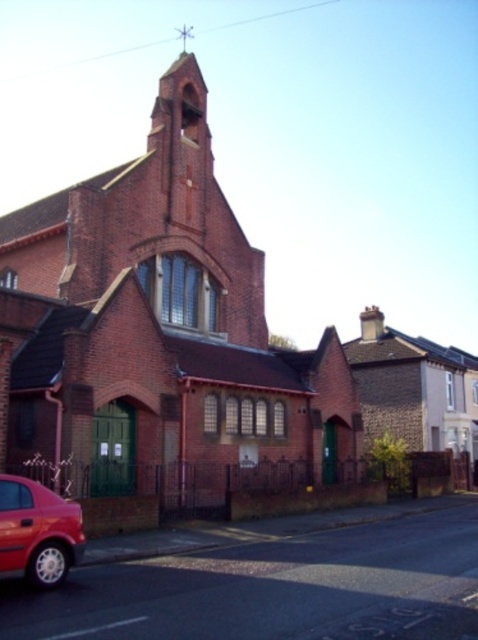
You are a photographer planning to take a wide shot of the red brick chapel at center and the shiny red car at lower left. Which object should you focus on first to ensure it appears larger in the photo?

The red brick chapel at center is bigger than the shiny red car at lower left, so you should focus on the red brick chapel at center first to ensure it appears larger in the photo.

You are a photographer wanting to capture the red brick chapel at center and the shiny red car at lower left in a single frame. Given their height difference, which object will appear larger in the photo?

The red brick chapel at center will appear larger in the photo because it is much taller than the shiny red car at lower left.